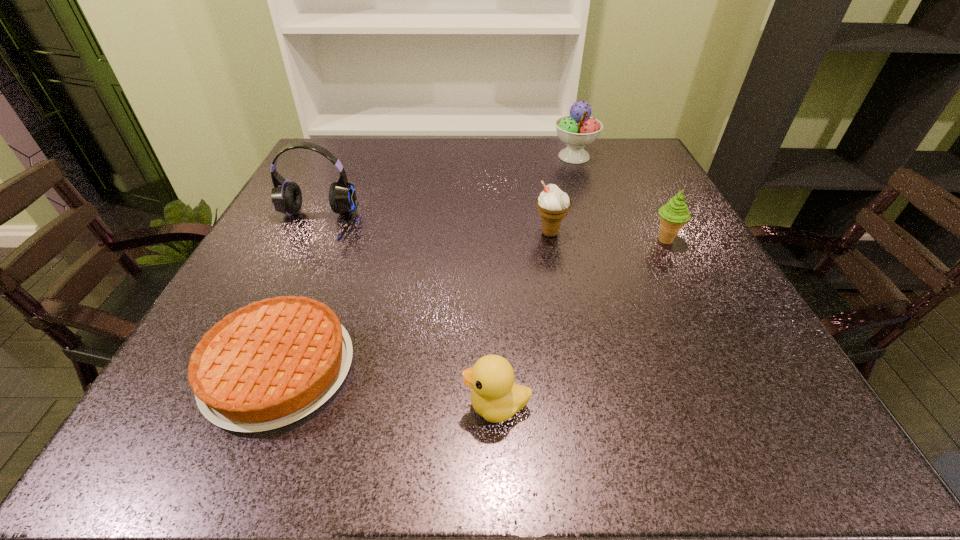
Find the location of `pie situated at the left edge`. pie situated at the left edge is located at coordinates (271, 363).

You are a GUI agent. You are given a task and a screenshot of the screen. Output one action in this format:
    pyautogui.click(x=<x>, y=<y>)
    Task: Click on the object that is positioned at the near left corner
    This screenshot has height=540, width=960.
    Given the screenshot: What is the action you would take?
    pyautogui.click(x=271, y=363)

At what (x,y) coordinates should I click in order to perform the action: click on object at the far right corner. Please return your answer as a coordinate pair (x, y). The width and height of the screenshot is (960, 540). Looking at the image, I should click on (577, 130).

You are a GUI agent. You are given a task and a screenshot of the screen. Output one action in this format:
    pyautogui.click(x=<x>, y=<y>)
    Task: Click on the free region at the far edge
    
    Given the screenshot: What is the action you would take?
    pyautogui.click(x=368, y=164)

In the image, there is a desktop. What are the coordinates of `free region at the near edge` in the screenshot? It's located at (279, 442).

The height and width of the screenshot is (540, 960). What are the coordinates of `free space at the left edge of the desktop` in the screenshot? It's located at (293, 238).

Where is `vacant space at the right edge`? Image resolution: width=960 pixels, height=540 pixels. vacant space at the right edge is located at coordinates (710, 389).

I want to click on free space at the far left corner of the desktop, so click(357, 141).

Image resolution: width=960 pixels, height=540 pixels. Find the location of `vacant space at the far right corner of the desktop`. vacant space at the far right corner of the desktop is located at coordinates (652, 156).

You are a GUI agent. You are given a task and a screenshot of the screen. Output one action in this format:
    pyautogui.click(x=<x>, y=<y>)
    Task: Click on the free space that is in between the third object from left to right and the pie
    
    Given the screenshot: What is the action you would take?
    pyautogui.click(x=388, y=387)